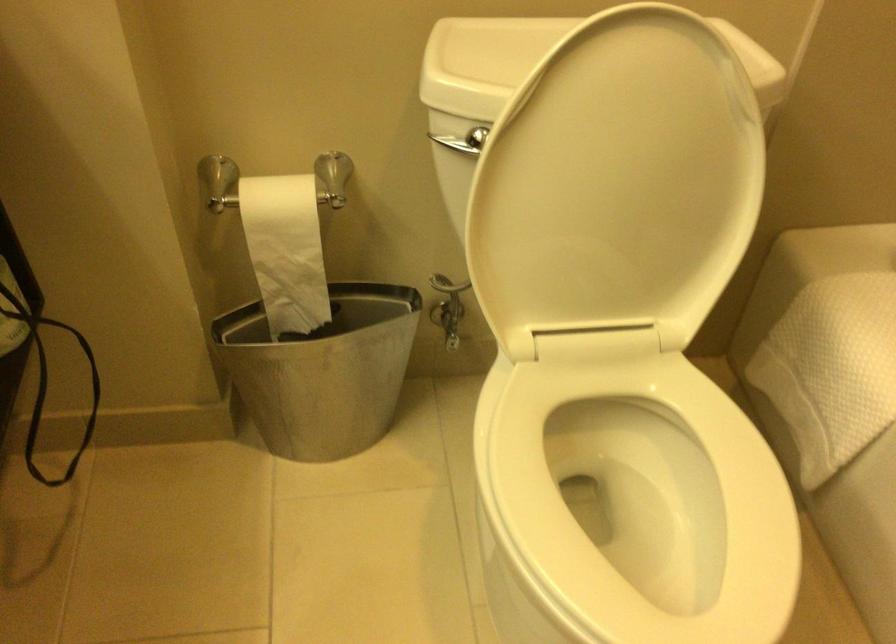
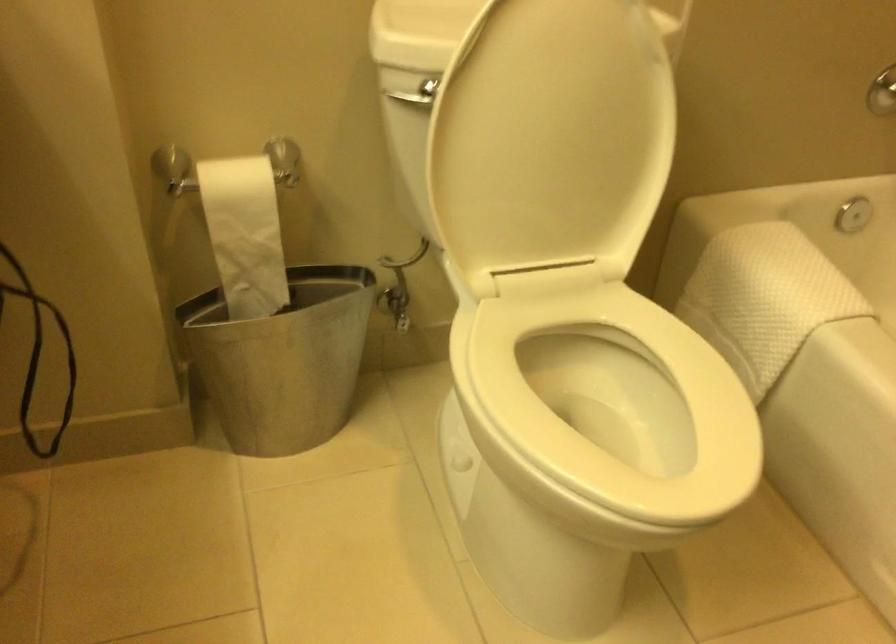
Question: The first image is from the beginning of the video and the second image is from the end. How did the camera likely rotate when shooting the video?

Choices:
 (A) Left
 (B) Right
 (C) Up
 (D) Down

Answer: (B)